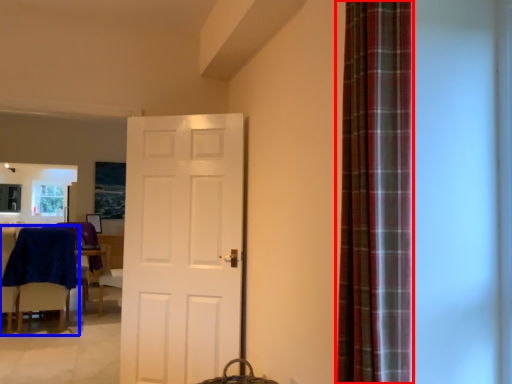
Question: Which object is further to the camera taking this photo, curtain (highlighted by a red box) or chair (highlighted by a blue box)?

Choices:
 (A) curtain
 (B) chair

Answer: (B)